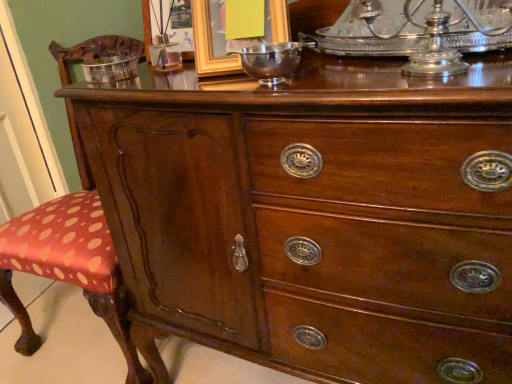
You are a GUI agent. You are given a task and a screenshot of the screen. Output one action in this format:
    pyautogui.click(x=<x>, y=<y>)
    Task: Click on the free space to the right of shiny silver bowl at center
    
    Given the screenshot: What is the action you would take?
    pyautogui.click(x=353, y=75)